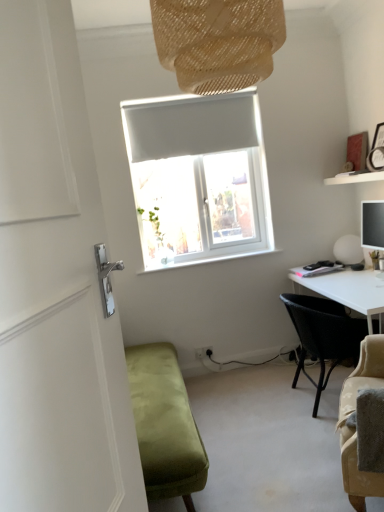
Question: From a real-world perspective, is white matte shelf at upper right physically below white matte sphere at right?

Choices:
 (A) no
 (B) yes

Answer: (A)

Question: From the image's perspective, would you say white matte shelf at upper right is positioned over white matte sphere at right?

Choices:
 (A) no
 (B) yes

Answer: (B)

Question: Is white matte shelf at upper right oriented away from white matte sphere at right?

Choices:
 (A) no
 (B) yes

Answer: (A)

Question: Can you confirm if white matte shelf at upper right is positioned to the right of white matte sphere at right?

Choices:
 (A) no
 (B) yes

Answer: (A)

Question: Could white matte sphere at right be considered to be inside white matte shelf at upper right?

Choices:
 (A) yes
 (B) no

Answer: (B)

Question: Considering the positions of brown woven lampshade at upper center and white matte sphere at right in the image, is brown woven lampshade at upper center bigger or smaller than white matte sphere at right?

Choices:
 (A) big
 (B) small

Answer: (A)

Question: Relative to white matte sphere at right, is brown woven lampshade at upper center in front or behind?

Choices:
 (A) behind
 (B) front

Answer: (B)

Question: Would you say brown woven lampshade at upper center is to the left or to the right of white matte sphere at right in the picture?

Choices:
 (A) right
 (B) left

Answer: (B)

Question: Is point (256, 53) positioned closer to the camera than point (349, 253)?

Choices:
 (A) farther
 (B) closer

Answer: (B)

Question: Is white matte shelf at upper right wider or thinner than white matte sphere at right?

Choices:
 (A) thin
 (B) wide

Answer: (B)

Question: From the image's perspective, is white matte shelf at upper right located above or below white matte sphere at right?

Choices:
 (A) above
 (B) below

Answer: (A)

Question: Is white matte shelf at upper right to the left or to the right of white matte sphere at right in the image?

Choices:
 (A) left
 (B) right

Answer: (A)

Question: Based on their sizes in the image, would you say white matte shelf at upper right is bigger or smaller than white matte sphere at right?

Choices:
 (A) big
 (B) small

Answer: (A)

Question: Which is correct: white glossy door handle at left is inside white matte sphere at right, or outside of it?

Choices:
 (A) inside
 (B) outside

Answer: (B)

Question: From a real-world perspective, relative to white matte sphere at right, is white glossy door handle at left vertically above or below?

Choices:
 (A) above
 (B) below

Answer: (A)